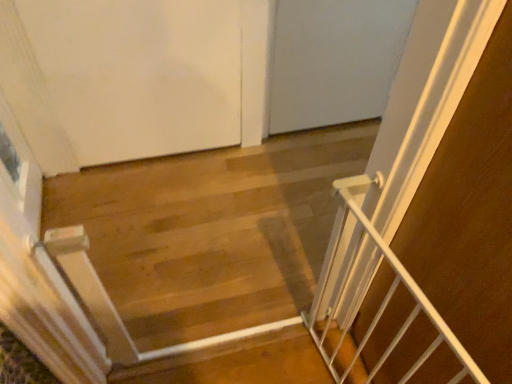
The width and height of the screenshot is (512, 384). I want to click on vacant space in front of white matte door at upper left, so click(x=160, y=232).